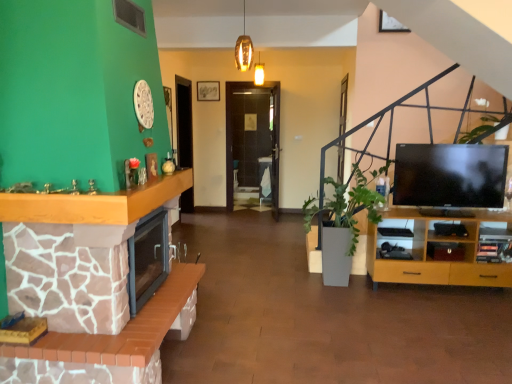
What is the approximate width of brick textured fireplace at left?

It is 23.69 inches.

In order to face brick textured fireplace at left, should I rotate leftwards or rightwards?

It's best to rotate left around 18.782 degrees.

What do you see at coordinates (87, 285) in the screenshot? I see `brick textured fireplace at left` at bounding box center [87, 285].

At what (x,y) coordinates should I click in order to perform the action: click on brick textured fireplace at left. Please return your answer as a coordinate pair (x, y). This screenshot has height=384, width=512. Looking at the image, I should click on (87, 285).

Where is `brick textured fireplace at left`? This screenshot has width=512, height=384. brick textured fireplace at left is located at coordinates (87, 285).